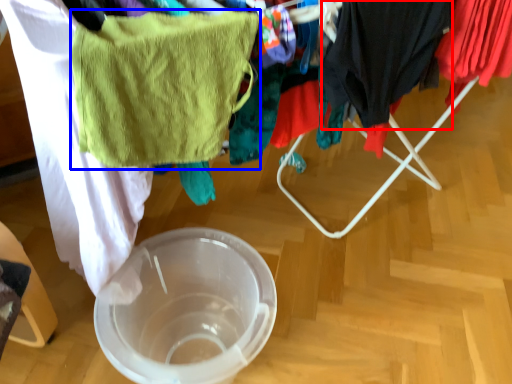
Question: Which of the following is the farthest to the observer, clothing (highlighted by a red box) or towel/napkin (highlighted by a blue box)?

Choices:
 (A) clothing
 (B) towel/napkin

Answer: (A)